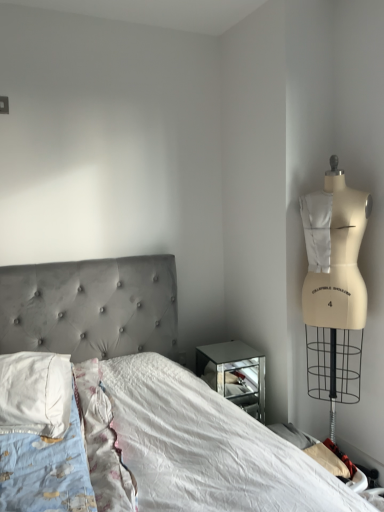
Question: From the image's perspective, is velvet grey bed at center above white soft pillow at left?

Choices:
 (A) no
 (B) yes

Answer: (A)

Question: Considering the relative positions of velvet grey bed at center and white soft pillow at left in the image provided, is velvet grey bed at center in front of white soft pillow at left?

Choices:
 (A) no
 (B) yes

Answer: (B)

Question: Is velvet grey bed at center positioned far away from white soft pillow at left?

Choices:
 (A) yes
 (B) no

Answer: (B)

Question: Is velvet grey bed at center aimed at white soft pillow at left?

Choices:
 (A) yes
 (B) no

Answer: (B)

Question: Considering the relative sizes of velvet grey bed at center and white soft pillow at left in the image provided, is velvet grey bed at center shorter than white soft pillow at left?

Choices:
 (A) yes
 (B) no

Answer: (B)

Question: Is velvet grey bed at center in contact with white soft pillow at left?

Choices:
 (A) no
 (B) yes

Answer: (A)

Question: Is white soft pillow at left thinner than velvet grey bed at center?

Choices:
 (A) no
 (B) yes

Answer: (B)

Question: Is white soft pillow at left positioned with its back to velvet grey bed at center?

Choices:
 (A) no
 (B) yes

Answer: (B)

Question: From the image's perspective, does white soft pillow at left appear higher than velvet grey bed at center?

Choices:
 (A) no
 (B) yes

Answer: (B)

Question: Could you tell me if white soft pillow at left is turned towards velvet grey bed at center?

Choices:
 (A) no
 (B) yes

Answer: (B)

Question: From a real-world perspective, is white soft pillow at left located beneath velvet grey bed at center?

Choices:
 (A) no
 (B) yes

Answer: (A)

Question: Is velvet grey bed at center completely or partially inside white soft pillow at left?

Choices:
 (A) no
 (B) yes

Answer: (A)

Question: Is point (23, 345) closer or farther from the camera than point (41, 388)?

Choices:
 (A) closer
 (B) farther

Answer: (B)